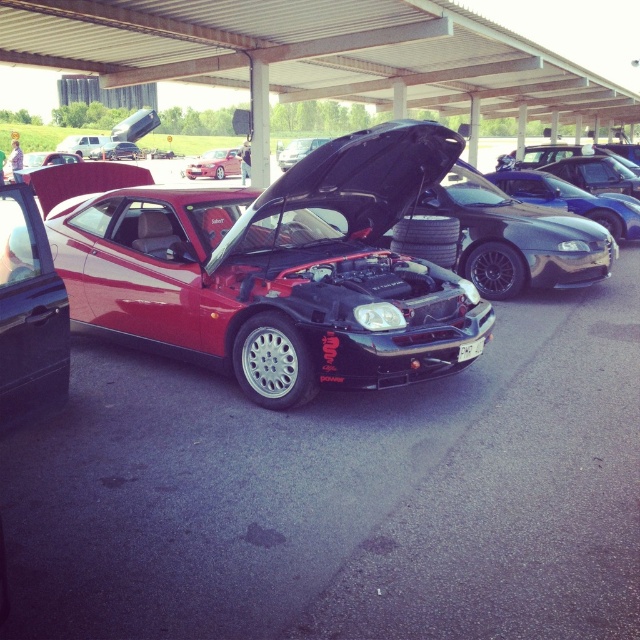
Does shiny metallic car at center appear under glossy black car at center?

No.

This screenshot has height=640, width=640. I want to click on shiny metallic car at center, so click(x=214, y=164).

Locate an element on the screen. shiny metallic car at center is located at coordinates (214, 164).

Measure the distance between glossy black car at center and matte black car at center.

A distance of 49.72 feet exists between glossy black car at center and matte black car at center.

Which is in front, point (291, 152) or point (129, 150)?

Point (291, 152) is more forward.

This screenshot has width=640, height=640. Identify the location of glossy black car at center. (298, 150).

Is point (195, 170) in front of point (102, 156)?

That is True.

Which is behind, point (220, 164) or point (92, 156)?

Positioned behind is point (92, 156).

Locate an element on the screen. This screenshot has height=640, width=640. shiny metallic car at center is located at coordinates (214, 164).